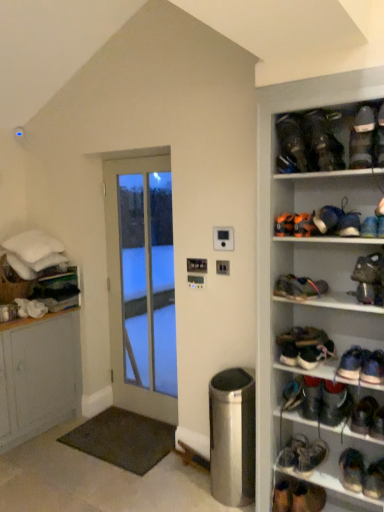
Question: Is blue suede sneakers at lower right, which is the 7th footwear in bottom-to-top order, oriented away from dark brown leather shoe at center right, the 10th footwear when ordered from bottom to top?

Choices:
 (A) yes
 (B) no

Answer: (B)

Question: Considering the relative sizes of blue suede sneakers at lower right, positioned as the 14th footwear in top-to-bottom order, and dark brown leather shoe at center right, marked as the 11th footwear in a top-to-bottom arrangement, in the image provided, is blue suede sneakers at lower right, positioned as the 14th footwear in top-to-bottom order, smaller than dark brown leather shoe at center right, marked as the 11th footwear in a top-to-bottom arrangement,?

Choices:
 (A) no
 (B) yes

Answer: (B)

Question: From a real-world perspective, is blue suede sneakers at lower right, which is the 7th footwear in bottom-to-top order, located higher than dark brown leather shoe at center right, marked as the 11th footwear in a top-to-bottom arrangement?

Choices:
 (A) no
 (B) yes

Answer: (A)

Question: Is blue suede sneakers at lower right, positioned as the 14th footwear in top-to-bottom order, completely or partially outside of dark brown leather shoe at center right, marked as the 11th footwear in a top-to-bottom arrangement?

Choices:
 (A) yes
 (B) no

Answer: (A)

Question: From the image's perspective, is blue suede sneakers at lower right, positioned as the 14th footwear in top-to-bottom order, located beneath dark brown leather shoe at center right, marked as the 11th footwear in a top-to-bottom arrangement?

Choices:
 (A) no
 (B) yes

Answer: (B)

Question: From the image's perspective, is blue suede sneakers at lower right, which is the 7th footwear in bottom-to-top order, located above dark brown leather shoe at center right, marked as the 11th footwear in a top-to-bottom arrangement?

Choices:
 (A) no
 (B) yes

Answer: (A)

Question: Does blue suede sneaker at upper right, the 6th footwear when ordered from top to bottom, appear on the right side of white glass door at center?

Choices:
 (A) no
 (B) yes

Answer: (B)

Question: Does blue suede sneaker at upper right, the 6th footwear when ordered from top to bottom, appear on the left side of white glass door at center?

Choices:
 (A) no
 (B) yes

Answer: (A)

Question: Would you say blue suede sneaker at upper right, the fifteenth footwear in the bottom-to-top sequence, is outside white glass door at center?

Choices:
 (A) yes
 (B) no

Answer: (A)

Question: Does blue suede sneaker at upper right, the fifteenth footwear in the bottom-to-top sequence, have a greater width compared to white glass door at center?

Choices:
 (A) no
 (B) yes

Answer: (B)

Question: Does blue suede sneaker at upper right, the 6th footwear when ordered from top to bottom, have a lesser height compared to white glass door at center?

Choices:
 (A) yes
 (B) no

Answer: (A)

Question: From the image's perspective, is blue suede sneaker at upper right, the fifteenth footwear in the bottom-to-top sequence, on top of white glass door at center?

Choices:
 (A) yes
 (B) no

Answer: (A)

Question: Is blue suede shoe at upper right, acting as the 16th footwear starting from the bottom, not inside dark brown leather shoe at center right, the 10th footwear when ordered from bottom to top?

Choices:
 (A) no
 (B) yes

Answer: (B)